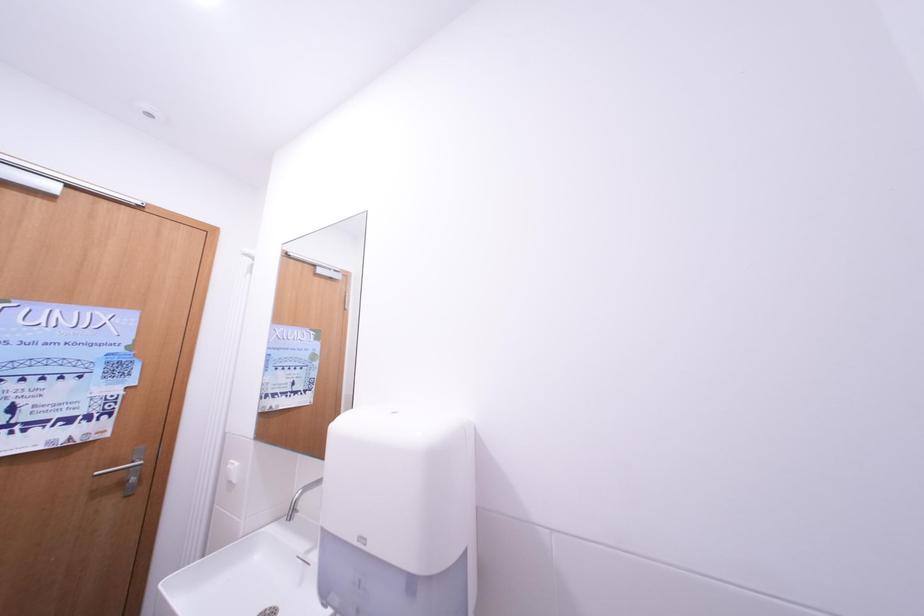
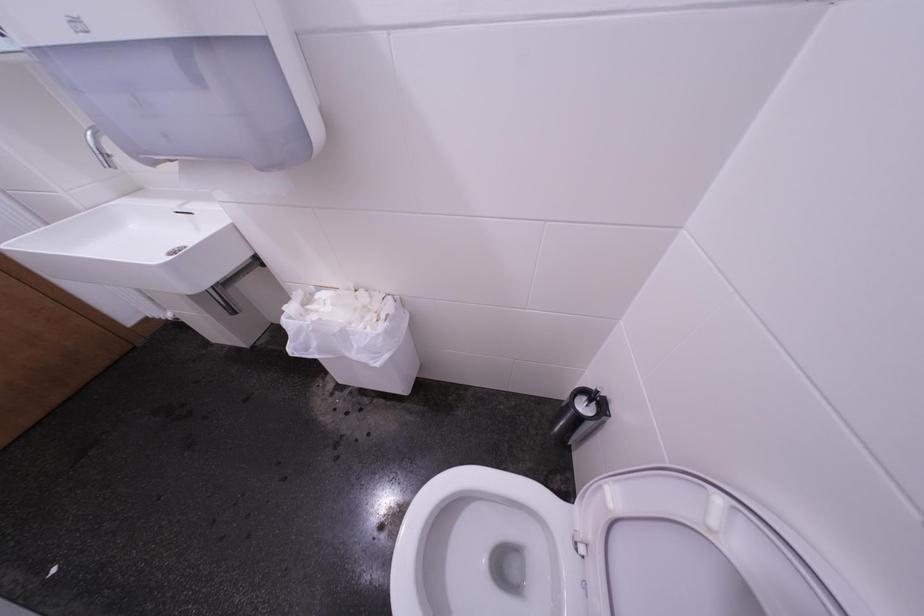
Based on the continuous images, in which direction is the camera rotating?

The camera rotated toward right-down.